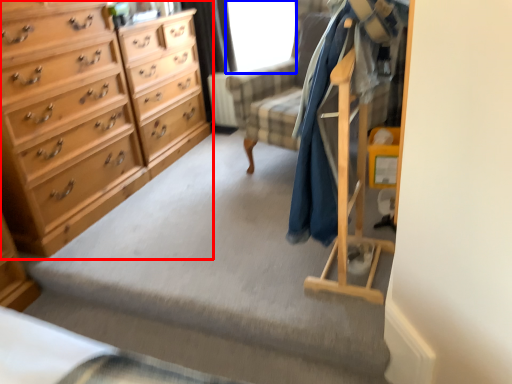
Question: Which object is closer to the camera taking this photo, chest of drawers (highlighted by a red box) or window screen (highlighted by a blue box)?

Choices:
 (A) chest of drawers
 (B) window screen

Answer: (A)